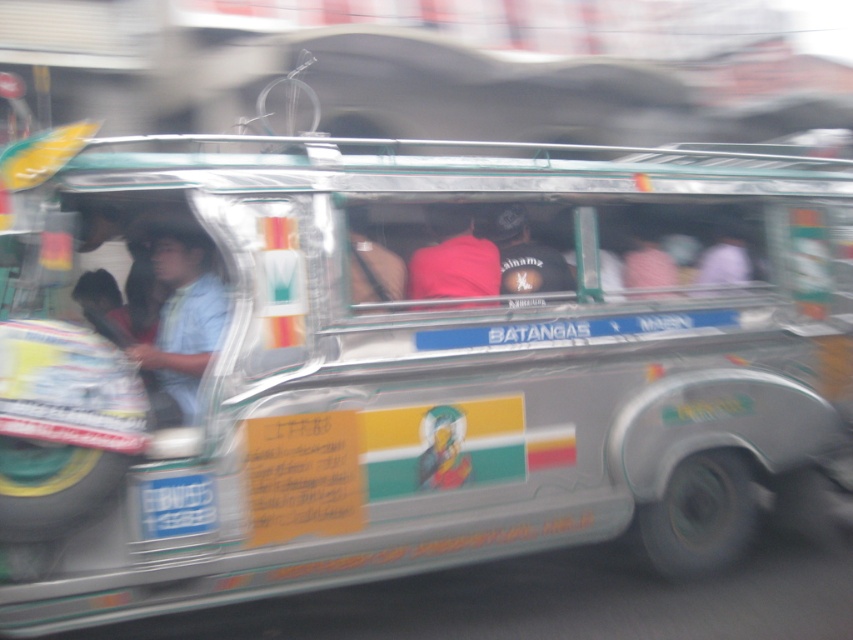
Question: Which object is closer to the camera taking this photo?

Choices:
 (A) matte blue shirt at center
 (B) pink fabric at center

Answer: (A)

Question: Is matte blue shirt at center below pink fabric at center?

Choices:
 (A) yes
 (B) no

Answer: (A)

Question: Is matte blue shirt at center to the right of pink fabric at center from the viewer's perspective?

Choices:
 (A) no
 (B) yes

Answer: (A)

Question: Which point is closer to the camera?

Choices:
 (A) dark gray fabric cap at center
 (B) matte blue shirt at center
 (C) pink fabric at center

Answer: (B)

Question: Which point is farther to the camera?

Choices:
 (A) (195, 259)
 (B) (502, 266)
 (C) (445, 209)

Answer: (C)

Question: In this image, where is matte blue shirt at center located relative to dark gray fabric cap at center?

Choices:
 (A) right
 (B) left

Answer: (B)